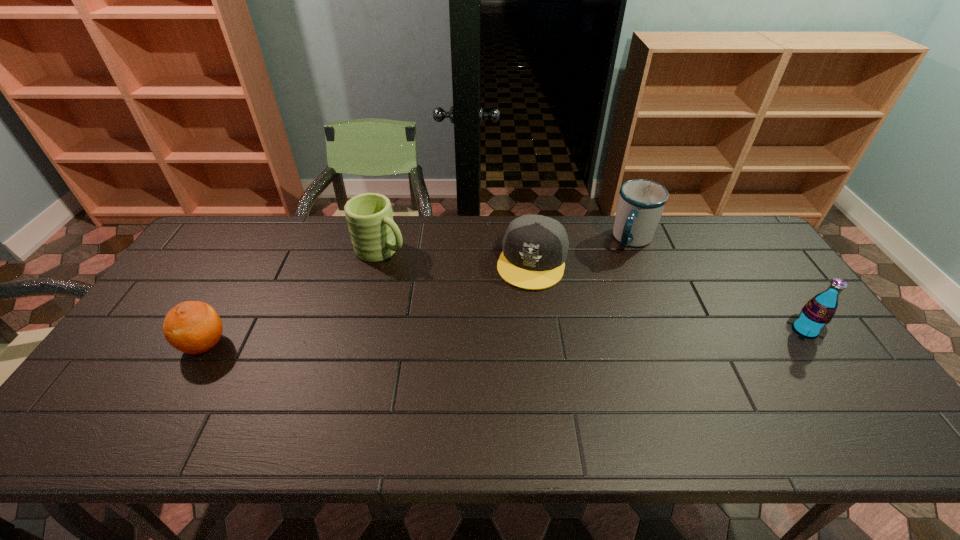
The width and height of the screenshot is (960, 540). I want to click on vacant space located on the handle side of the right mug, so click(x=598, y=333).

What are the coordinates of `free region located on the handle side of the right mug` in the screenshot? It's located at (619, 280).

This screenshot has width=960, height=540. Find the location of `vacant position located 0.350m on the handle side of the right mug`. vacant position located 0.350m on the handle side of the right mug is located at coordinates (599, 330).

You are a GUI agent. You are given a task and a screenshot of the screen. Output one action in this format:
    pyautogui.click(x=<x>, y=<y>)
    Task: Click on the vacant area situated on the side of the left mug with the handle
    The width and height of the screenshot is (960, 540).
    Given the screenshot: What is the action you would take?
    pyautogui.click(x=420, y=273)

Find the location of `free space located on the side of the left mug with the handle`. free space located on the side of the left mug with the handle is located at coordinates (430, 278).

You are a GUI agent. You are given a task and a screenshot of the screen. Output one action in this format:
    pyautogui.click(x=<x>, y=<y>)
    Task: Click on the free spot located on the side of the left mug with the handle
    The height and width of the screenshot is (540, 960).
    Given the screenshot: What is the action you would take?
    pyautogui.click(x=430, y=278)

Where is `cap present at the far edge`? This screenshot has width=960, height=540. cap present at the far edge is located at coordinates (535, 247).

At what (x,y) coordinates should I click in order to perform the action: click on object at the left edge. Please return your answer as a coordinate pair (x, y). This screenshot has height=540, width=960. Looking at the image, I should click on (193, 327).

I want to click on object at the right edge, so click(811, 323).

You are a GUI agent. You are given a task and a screenshot of the screen. Output one action in this format:
    pyautogui.click(x=<x>, y=<y>)
    Task: Click on the vacant space at the far edge of the desktop
    Image resolution: width=960 pixels, height=540 pixels.
    Given the screenshot: What is the action you would take?
    pyautogui.click(x=332, y=244)